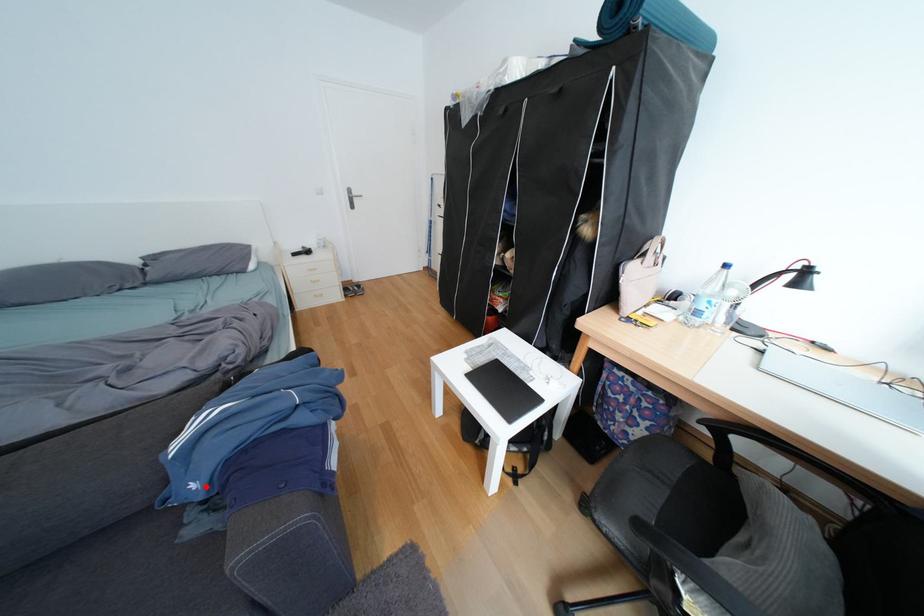
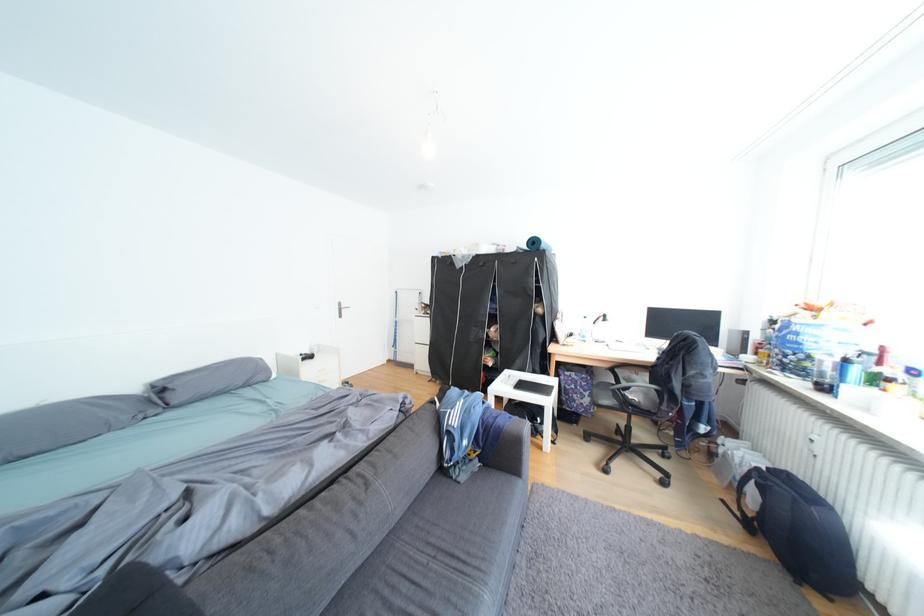
Find the pixel in the second image that matches the highlighted location in the first image.

(478, 444)